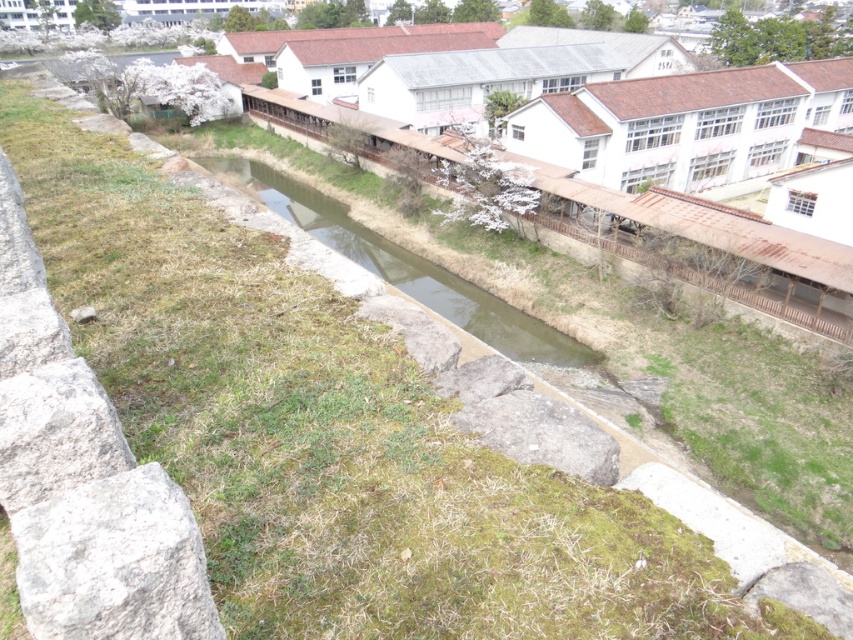
Between point (152, 472) and point (346, 209), which one is positioned behind?

Point (346, 209)

Is point (177, 504) more distant than point (527, 348)?

No, it is not.

Does point (175, 536) lie behind point (386, 252)?

No, it is not.

At what (x,y) coordinates should I click in order to perform the action: click on gray rough stone at lower left. Please return your answer as a coordinate pair (x, y). The image size is (853, 640). Looking at the image, I should click on (114, 563).